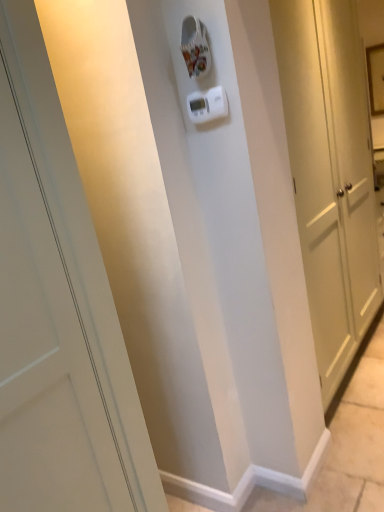
I want to click on white plastic thermostat at center, so 207,105.

This screenshot has height=512, width=384. Describe the element at coordinates (207, 105) in the screenshot. I see `white plastic thermostat at center` at that location.

The image size is (384, 512). I want to click on white plastic thermostat at center, so click(207, 105).